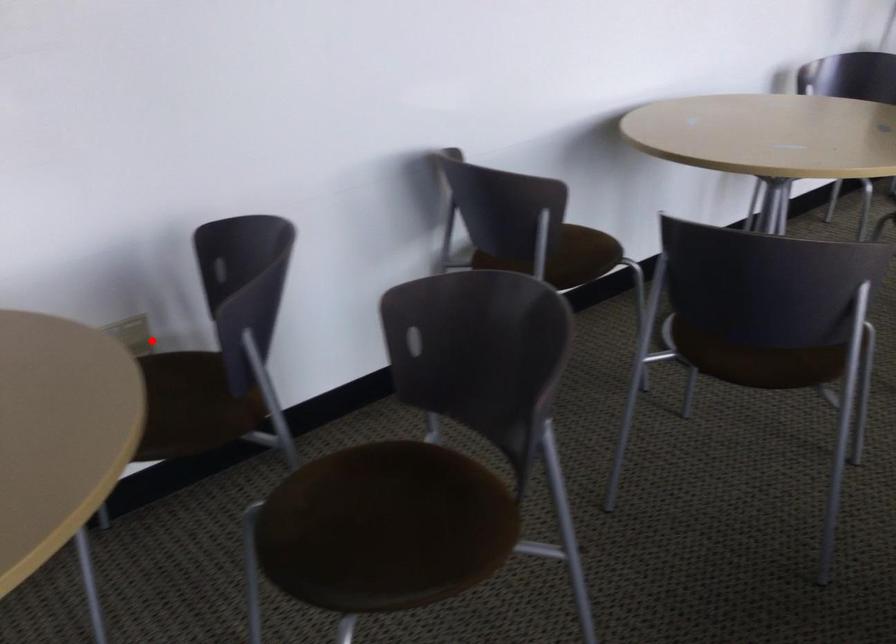
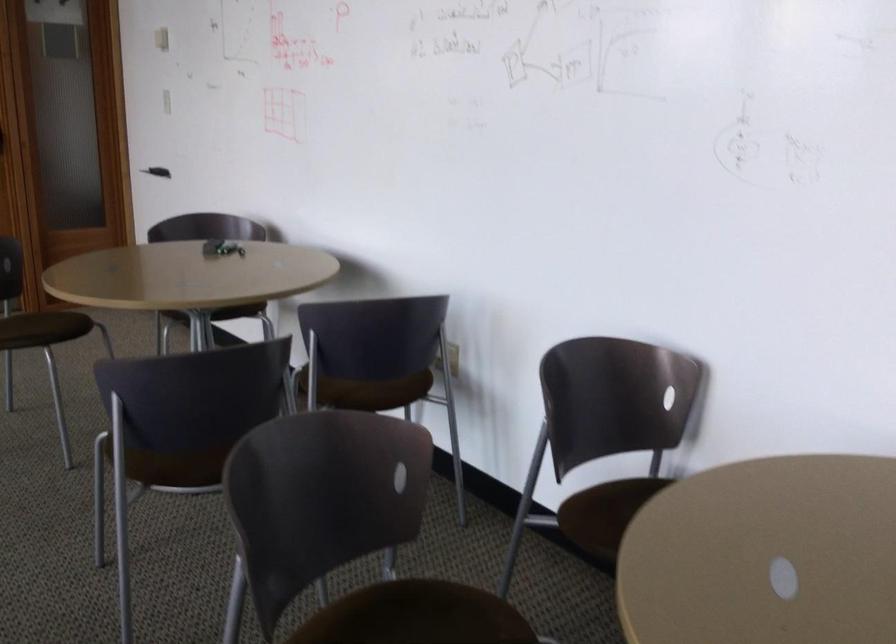
Where in the second image is the point corresponding to the highlighted location from the first image?

(452, 359)